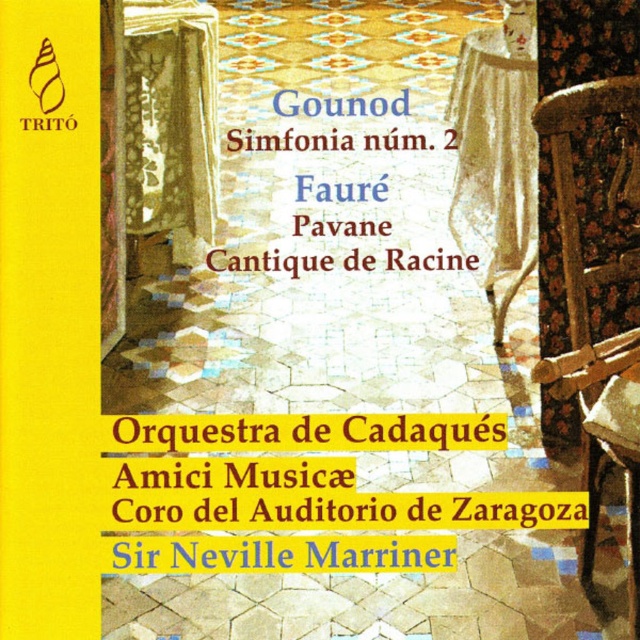
Question: Considering the relative positions of patterned fabric tablecloth at upper left and white lace tablecloth at upper right in the image provided, where is patterned fabric tablecloth at upper left located with respect to white lace tablecloth at upper right?

Choices:
 (A) right
 (B) left

Answer: (B)

Question: Which of these objects is positioned farthest from the white lace tablecloth at upper right?

Choices:
 (A) wooden chair at right
 (B) patterned fabric tablecloth at upper left

Answer: (B)

Question: Can you confirm if patterned fabric tablecloth at upper left is positioned to the right of white lace tablecloth at upper right?

Choices:
 (A) yes
 (B) no

Answer: (B)

Question: Is wooden chair at right wider than white lace tablecloth at upper right?

Choices:
 (A) no
 (B) yes

Answer: (B)

Question: Estimate the real-world distances between objects in this image. Which object is farther from the patterned fabric tablecloth at upper left?

Choices:
 (A) wooden chair at right
 (B) white lace tablecloth at upper right

Answer: (A)

Question: Estimate the real-world distances between objects in this image. Which object is closer to the white lace tablecloth at upper right?

Choices:
 (A) patterned fabric tablecloth at upper left
 (B) wooden chair at right

Answer: (B)